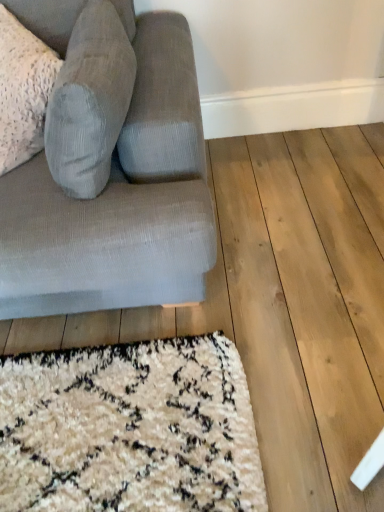
Image resolution: width=384 pixels, height=512 pixels. I want to click on vacant space to the right of textured gray couch at left, so click(286, 223).